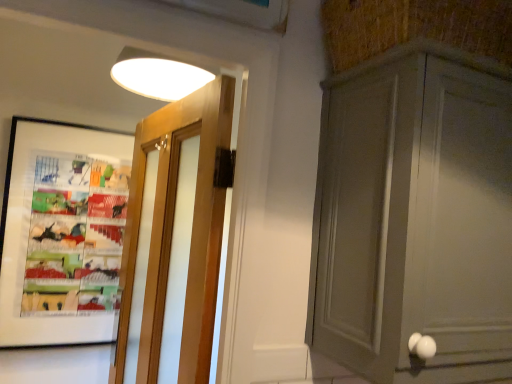
What do you see at coordinates (62, 232) in the screenshot? The width and height of the screenshot is (512, 384). I see `matte black picture frame at left` at bounding box center [62, 232].

This screenshot has width=512, height=384. Find the location of `wooden door at left`. wooden door at left is located at coordinates (175, 239).

At what (x,y) coordinates should I click in order to perform the action: click on matte black picture frame at left. Please return your answer as a coordinate pair (x, y). The width and height of the screenshot is (512, 384). Looking at the image, I should click on (62, 232).

Are wooden door at left and matte gray cabinet at right making contact?

wooden door at left is not next to matte gray cabinet at right, and they're not touching.

Choose the correct answer: Is wooden door at left inside matte gray cabinet at right or outside it?

wooden door at left lies outside matte gray cabinet at right.

Considering the relative sizes of wooden door at left and matte gray cabinet at right in the image provided, is wooden door at left wider than matte gray cabinet at right?

Incorrect, the width of wooden door at left does not surpass that of matte gray cabinet at right.

Is matte black picture frame at left positioned far away from matte gray cabinet at right?

Indeed, matte black picture frame at left is not near matte gray cabinet at right.

From the image's perspective, is matte black picture frame at left under matte gray cabinet at right?

Correct, matte black picture frame at left appears lower than matte gray cabinet at right in the image.

Is matte black picture frame at left looking in the opposite direction of matte gray cabinet at right?

No, matte black picture frame at left is not facing away from matte gray cabinet at right.

Where is `picture frame that appears below the matte gray cabinet at right (from the image's perspective)`? The height and width of the screenshot is (384, 512). picture frame that appears below the matte gray cabinet at right (from the image's perspective) is located at coordinates (62, 232).

From the image's perspective, is wooden door at left beneath matte black picture frame at left?

Yes, from the image's perspective, wooden door at left is beneath matte black picture frame at left.

Does wooden door at left touch matte black picture frame at left?

No, wooden door at left is not touching matte black picture frame at left.

Which is in front, point (161, 165) or point (106, 267)?

The point (161, 165) is closer to the camera.

Considering the sizes of objects matte black picture frame at left and wooden door at left in the image provided, who is bigger, matte black picture frame at left or wooden door at left?

Bigger between the two is wooden door at left.

What's the angular difference between matte black picture frame at left and wooden door at left's facing directions?

There is a 82.2-degree angle between the facing directions of matte black picture frame at left and wooden door at left.

Who is taller, matte black picture frame at left or wooden door at left?

With more height is wooden door at left.

Could wooden door at left be considered to be inside matte black picture frame at left?

No, wooden door at left is not surrounded by matte black picture frame at left.

Between matte gray cabinet at right and wooden door at left, which one has less height?

matte gray cabinet at right is shorter.

From a real-world perspective, between matte gray cabinet at right and wooden door at left, who is vertically higher?

From a 3D spatial view, matte gray cabinet at right is above.

From the image's perspective, is matte gray cabinet at right positioned above or below wooden door at left?

matte gray cabinet at right is above wooden door at left.

The image size is (512, 384). In the image, there is a matte gray cabinet at right. In order to click on door below it (from a real-world perspective) in this screenshot , I will do `click(175, 239)`.

Considering the positions of objects matte gray cabinet at right and matte black picture frame at left in the image provided, who is more to the right, matte gray cabinet at right or matte black picture frame at left?

From the viewer's perspective, matte gray cabinet at right appears more on the right side.

Is matte gray cabinet at right next to matte black picture frame at left and touching it?

No.

From the image's perspective, would you say matte gray cabinet at right is shown under matte black picture frame at left?

Actually, matte gray cabinet at right appears above matte black picture frame at left in the image.

How different are the orientations of matte gray cabinet at right and matte black picture frame at left in degrees?

They differ by 1.12 degrees in their facing directions.

In the image, there is a wooden door at left. At what (x,y) coordinates should I click in order to perform the action: click on cabinetry above it (from the image's perspective). Please return your answer as a coordinate pair (x, y). The height and width of the screenshot is (384, 512). Looking at the image, I should click on (415, 217).

Locate an element on the screen. The width and height of the screenshot is (512, 384). cabinetry on the right of matte black picture frame at left is located at coordinates (415, 217).

Looking at the image, which one is located closer to wooden door at left, matte gray cabinet at right or matte black picture frame at left?

matte black picture frame at left lies closer to wooden door at left than the other object.

Based on their spatial positions, is wooden door at left or matte gray cabinet at right further from matte black picture frame at left?

Based on the image, matte gray cabinet at right appears to be further to matte black picture frame at left.

Looking at the image, which one is located further to matte gray cabinet at right, matte black picture frame at left or wooden door at left?

The object further to matte gray cabinet at right is matte black picture frame at left.

Looking at the image, which one is located further to matte black picture frame at left, matte gray cabinet at right or wooden door at left?

Based on the image, matte gray cabinet at right appears to be further to matte black picture frame at left.

Based on their spatial positions, is matte black picture frame at left or matte gray cabinet at right further from wooden door at left?

The object further to wooden door at left is matte gray cabinet at right.

Estimate the real-world distances between objects in this image. Which object is closer to matte gray cabinet at right, wooden door at left or matte black picture frame at left?

wooden door at left is closer to matte gray cabinet at right.

The image size is (512, 384). Identify the location of door between matte black picture frame at left and matte gray cabinet at right in the horizontal direction. (175, 239).